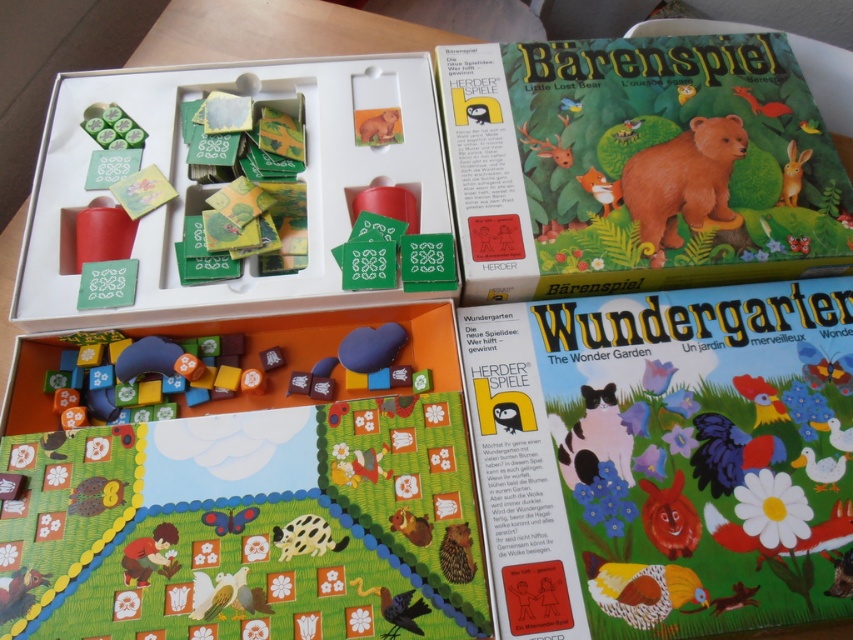
You are a child trying to reach the matte cardboard book at upper center on the game board. The book is part of the game and you need to grab it to continue playing. Can you safely reach it from your current position?

The matte cardboard book at upper center is 26.97 inches away from viewer, so if the child can reach that distance, they can grab it safely.

You are setting up the board game and need to place both the brown furry bear at upper center and the orange matte rabbit at upper right on the game board. Which animal has a smaller width?

The brown furry bear at upper center has a smaller width than the orange matte rabbit at upper right.

What are the coordinates of the wooden squirrel at lower left?

The wooden squirrel at lower left is located at coordinates point (18, 593).